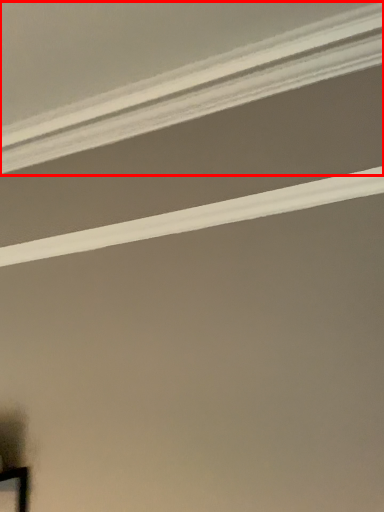
Question: From the image's perspective, what is the correct spatial relationship of strip (annotated by the red box) in relation to strip?

Choices:
 (A) above
 (B) below

Answer: (A)